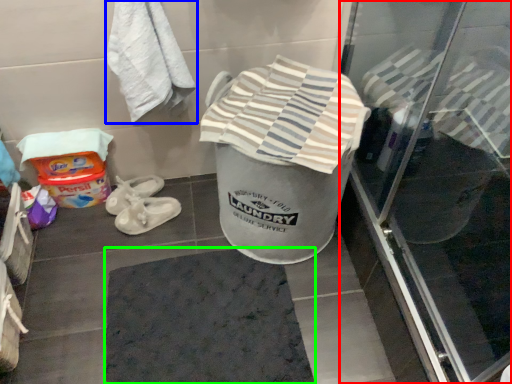
Question: Which object is the farthest from screen door (highlighted by a red box)? Choose among these: towel (highlighted by a blue box) or bath mat (highlighted by a green box).

Choices:
 (A) towel
 (B) bath mat

Answer: (A)